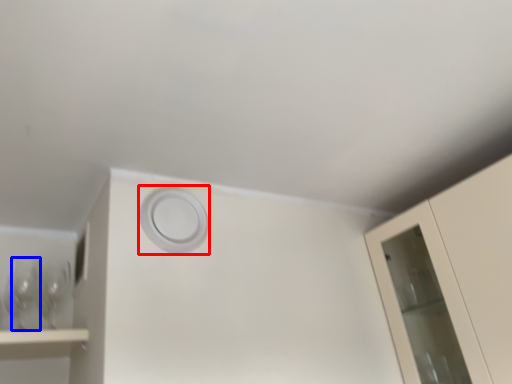
Question: Which object is further to the camera taking this photo, circle (highlighted by a red box) or wine glass (highlighted by a blue box)?

Choices:
 (A) circle
 (B) wine glass

Answer: (B)